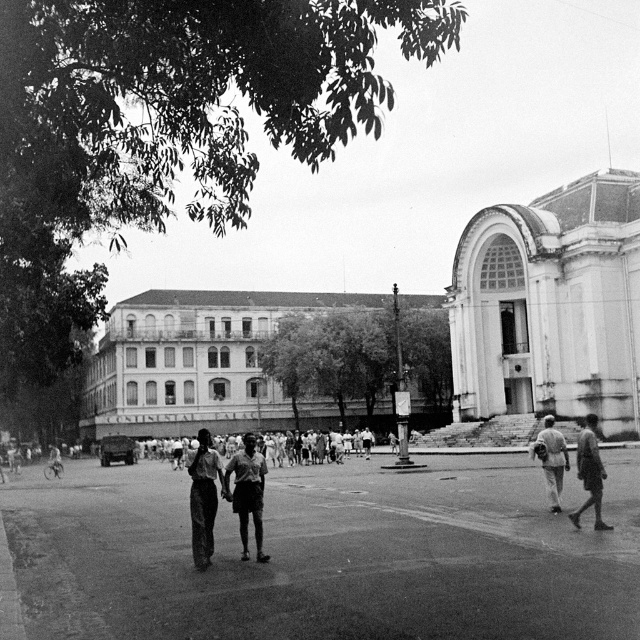
You are a photographer standing in the plaza and want to take a picture of the two people walking hand in hand. Since you need to frame them properly, can you tell me which direction you should move to get both the smooth asphalt plaza at center and the dark skin textured shorts at center in the same frame?

The smooth asphalt plaza at center is positioned on the right side of dark skin textured shorts at center, so you should move to the left to include both objects in the frame.

You are a pedestrian standing at the point labeled point (198, 497). You want to walk to the point labeled point (321, 554). Given that the building in the background is blocking your path, can you reach your destination without going around the building?

Point (321, 554) is behind point (198, 497). Since the building is blocking the path, you cannot reach point (321, 554) directly without going around the building.